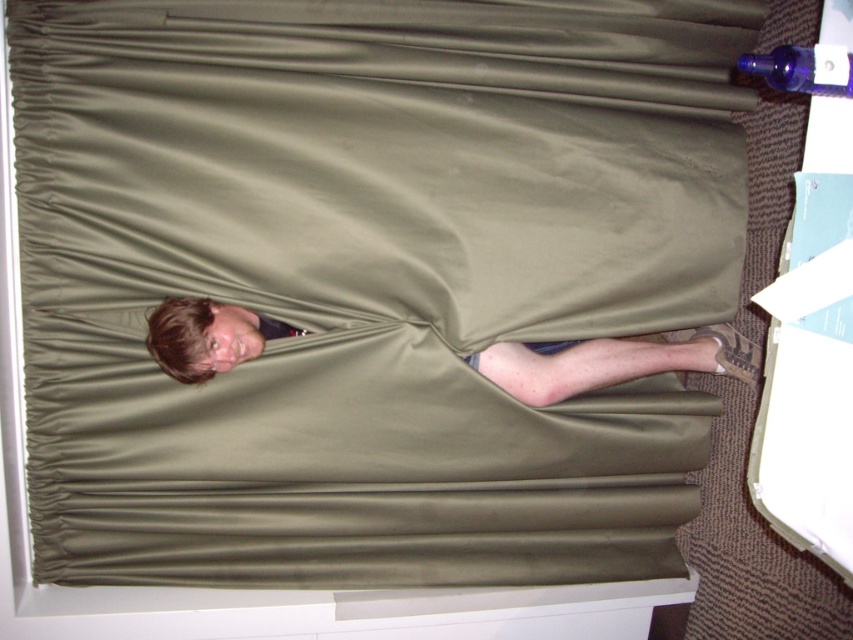
Does matte olive green fabric at lower center lie in front of transparent glass bottle at upper right?

No, it is not.

Does matte olive green fabric at lower center have a greater width compared to transparent glass bottle at upper right?

Indeed, matte olive green fabric at lower center has a greater width compared to transparent glass bottle at upper right.

Who is more distant from viewer, (x=228, y=330) or (x=834, y=61)?

Positioned behind is point (x=228, y=330).

You are a GUI agent. You are given a task and a screenshot of the screen. Output one action in this format:
    pyautogui.click(x=<x>, y=<y>)
    Task: Click on the matte olive green fabric at lower center
    
    Given the screenshot: What is the action you would take?
    pyautogui.click(x=612, y=362)